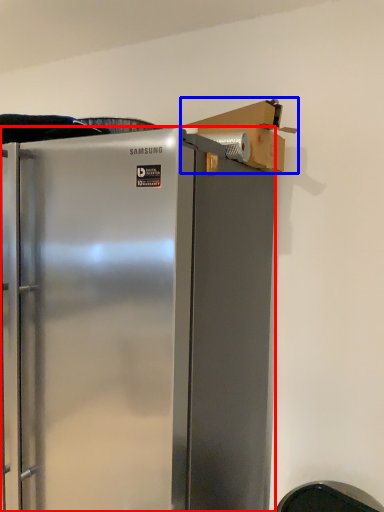
Question: Which of the following is the farthest to the observer, refrigerator (highlighted by a red box) or cardboard box (highlighted by a blue box)?

Choices:
 (A) refrigerator
 (B) cardboard box

Answer: (B)